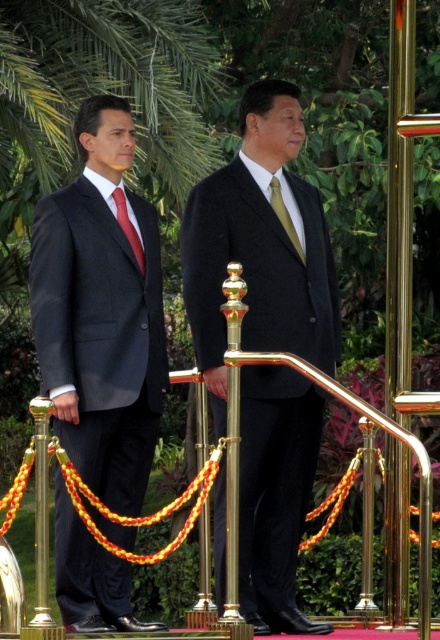
Question: Is black matte suit at center further to camera compared to red satin tie at left?

Choices:
 (A) no
 (B) yes

Answer: (A)

Question: Can you confirm if matte black suit at left is positioned to the right of red satin tie at left?

Choices:
 (A) no
 (B) yes

Answer: (A)

Question: Can you confirm if black matte suit at center is positioned to the right of gold silk tie at center?

Choices:
 (A) no
 (B) yes

Answer: (A)

Question: Which object appears farthest from the camera in this image?

Choices:
 (A) gold silk tie at center
 (B) gold polished metal railing at center
 (C) matte black suit at left
 (D) black matte suit at center

Answer: (A)

Question: Which of these objects is positioned closest to the gold polished metal railing at center?

Choices:
 (A) red satin tie at left
 (B) matte black suit at left
 (C) gold silk tie at center
 (D) black matte suit at center

Answer: (D)

Question: Which object is positioned farthest from the black matte suit at center?

Choices:
 (A) gold silk tie at center
 (B) red satin tie at left
 (C) gold polished metal railing at center

Answer: (B)